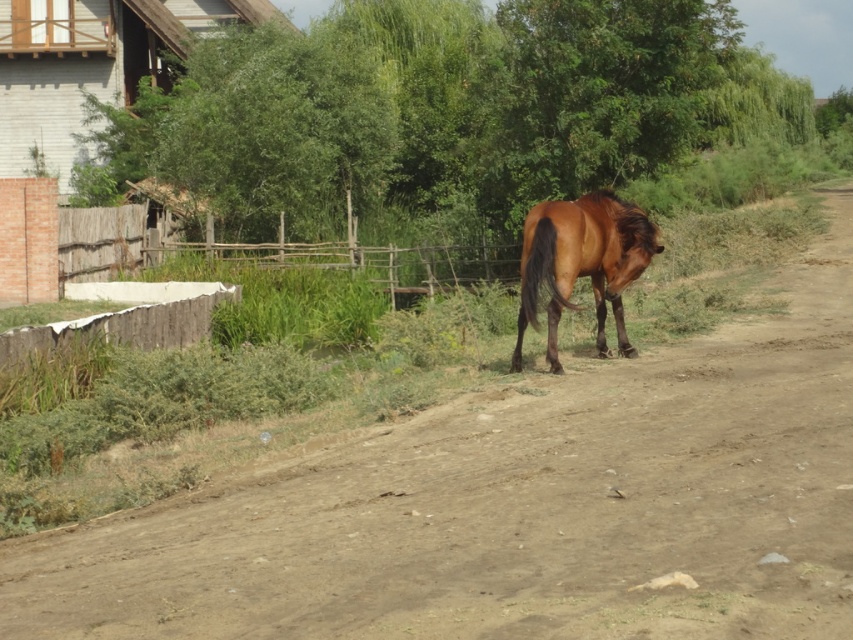
Question: Which point is farther from the camera taking this photo?

Choices:
 (A) (750, 323)
 (B) (641, 250)

Answer: (A)

Question: Is brown dirt track at center below brown glossy horse at center?

Choices:
 (A) yes
 (B) no

Answer: (A)

Question: Is brown dirt track at center positioned in front of brown glossy horse at center?

Choices:
 (A) no
 (B) yes

Answer: (B)

Question: From the image, what is the correct spatial relationship of brown dirt track at center in relation to brown glossy horse at center?

Choices:
 (A) above
 (B) below

Answer: (B)

Question: Among these points, which one is nearest to the camera?

Choices:
 (A) (570, 304)
 (B) (637, 545)

Answer: (B)

Question: Which point appears closest to the camera in this image?

Choices:
 (A) (445, 461)
 (B) (567, 204)

Answer: (A)